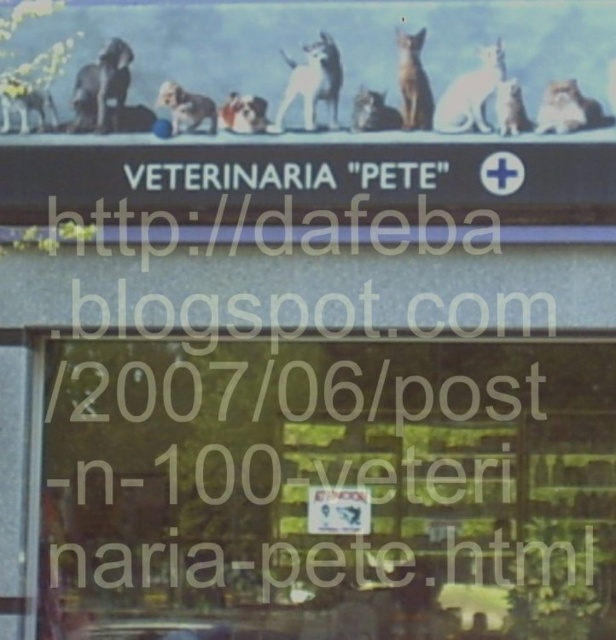
Question: Estimate the real-world distances between objects in this image. Which object is farther from the white fur dog at center?

Choices:
 (A) transparent glass shop window at center
 (B) white fur dog at upper left
 (C) fluffy white dog at center

Answer: (A)

Question: Among these objects, which one is farthest from the camera?

Choices:
 (A) white fur dog at center
 (B) white fur dog at upper left
 (C) transparent glass shop window at center
 (D) fluffy white dog at center

Answer: (B)

Question: Can you confirm if white fur dog at upper left is positioned below white fur dog at center?

Choices:
 (A) no
 (B) yes

Answer: (A)

Question: Is transparent glass shop window at center wider than white fur dog at center?

Choices:
 (A) yes
 (B) no

Answer: (A)

Question: Can you confirm if white fur dog at upper left is positioned to the left of fluffy white dog at center?

Choices:
 (A) yes
 (B) no

Answer: (A)

Question: Which point is closer to the camera?

Choices:
 (A) (208, 108)
 (B) (15, 77)
 (C) (593, 627)

Answer: (A)